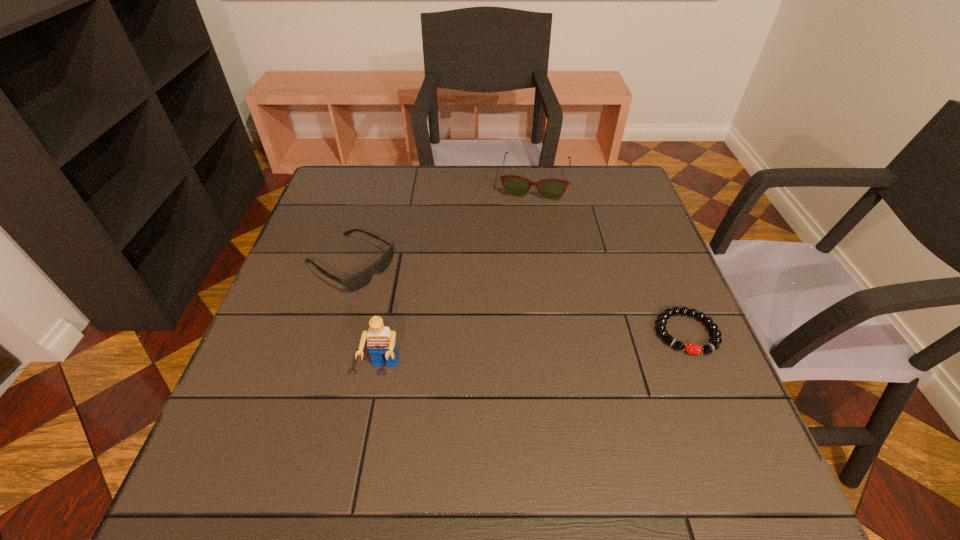
Image resolution: width=960 pixels, height=540 pixels. What are the coordinates of `free spot located 0.140m on the front-facing side of the sunglasses` in the screenshot? It's located at (426, 309).

What are the coordinates of `free space located at the front view of the spectacles` in the screenshot? It's located at (520, 288).

Where is `vacant position located at the front view of the spectacles`? The height and width of the screenshot is (540, 960). vacant position located at the front view of the spectacles is located at coordinates (523, 262).

Locate an element on the screen. Image resolution: width=960 pixels, height=540 pixels. blank area located 0.060m at the front view of the spectacles is located at coordinates (530, 214).

This screenshot has height=540, width=960. I want to click on object that is at the far edge, so click(516, 186).

You are a GUI agent. You are given a task and a screenshot of the screen. Output one action in this format:
    pyautogui.click(x=<x>, y=<y>)
    Task: Click on the object that is at the left edge
    Image resolution: width=960 pixels, height=540 pixels.
    Given the screenshot: What is the action you would take?
    pyautogui.click(x=353, y=283)

Locate an element on the screen. This screenshot has width=960, height=540. object that is at the right edge is located at coordinates (691, 348).

Where is `vacant space at the far edge of the desktop`? This screenshot has width=960, height=540. vacant space at the far edge of the desktop is located at coordinates (577, 175).

Image resolution: width=960 pixels, height=540 pixels. What are the coordinates of `free space at the near edge of the desktop` in the screenshot? It's located at (517, 436).

The height and width of the screenshot is (540, 960). Identify the location of free spot at the left edge of the desktop. (285, 333).